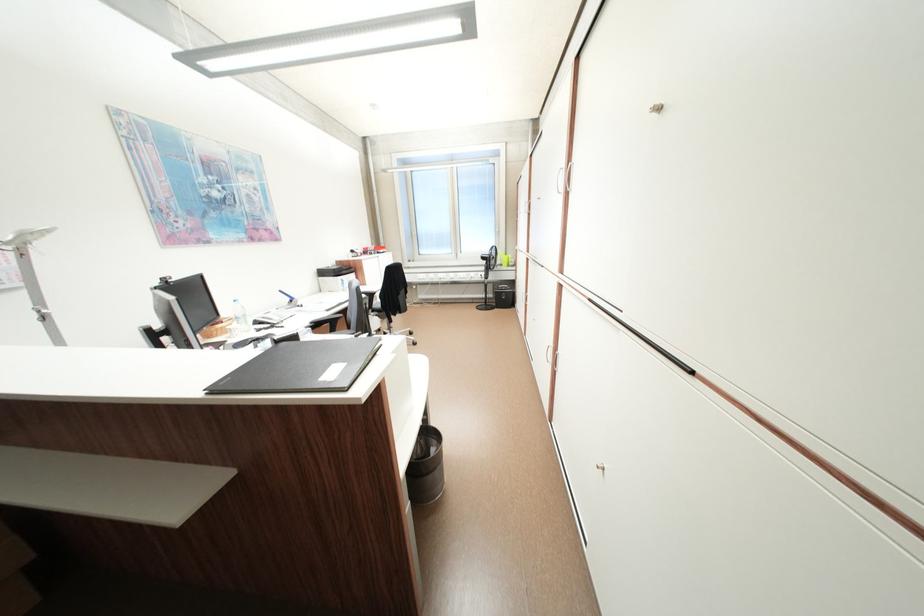
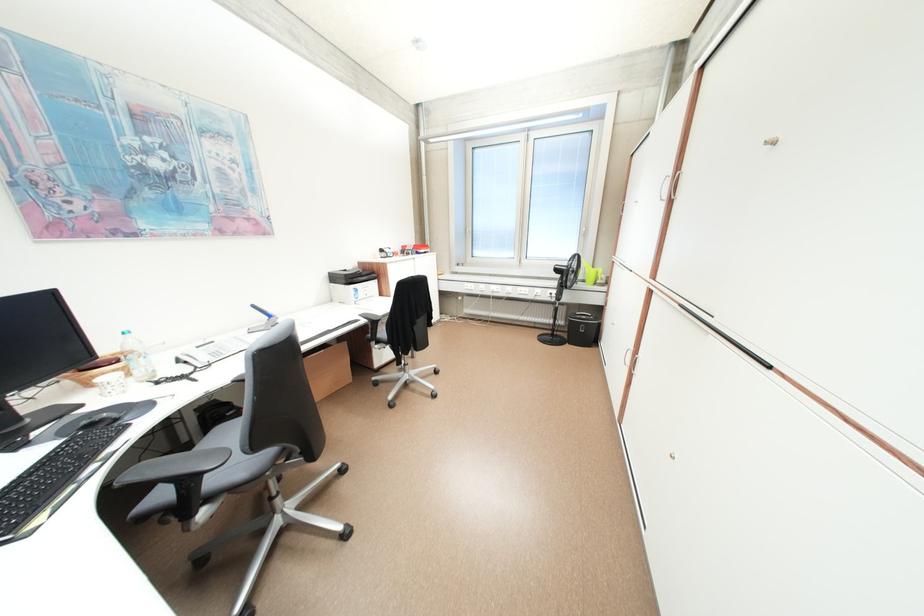
Where in the second image is the point corresponding to pixel 512 257 from the first image?

(598, 273)